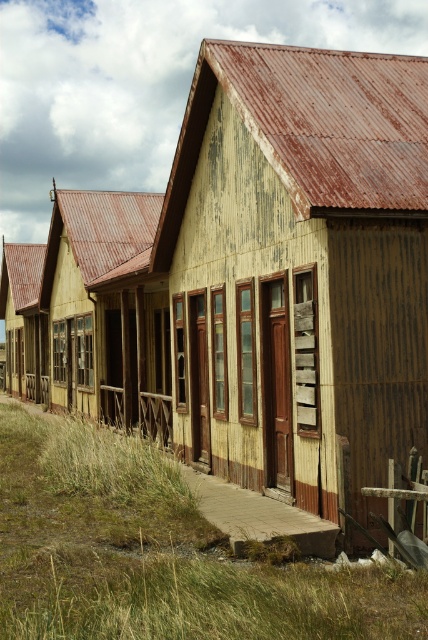
The height and width of the screenshot is (640, 428). Describe the element at coordinates (300, 268) in the screenshot. I see `weathered wood hut at center` at that location.

Is point (208, 288) less distant than point (190, 538)?

That is False.

Find the location of `weathered wood hut at center`. weathered wood hut at center is located at coordinates (300, 268).

Is green grass at lower left below wooden planks hut at center?

Yes, green grass at lower left is below wooden planks hut at center.

Does green grass at lower left have a greater width compared to wooden planks hut at center?

Indeed, green grass at lower left has a greater width compared to wooden planks hut at center.

Locate an element on the screen. green grass at lower left is located at coordinates (157, 554).

Locate an element on the screen. The width and height of the screenshot is (428, 640). green grass at lower left is located at coordinates (157, 554).

Is point (341, 228) in front of point (68, 230)?

That is True.

Does weathered wood hut at center have a greater height compared to wooden planks hut at center?

Correct, weathered wood hut at center is much taller as wooden planks hut at center.

Who is more forward, (x=267, y=86) or (x=76, y=401)?

Positioned in front is point (x=267, y=86).

Where is `weathered wood hut at center`? This screenshot has height=640, width=428. weathered wood hut at center is located at coordinates (300, 268).